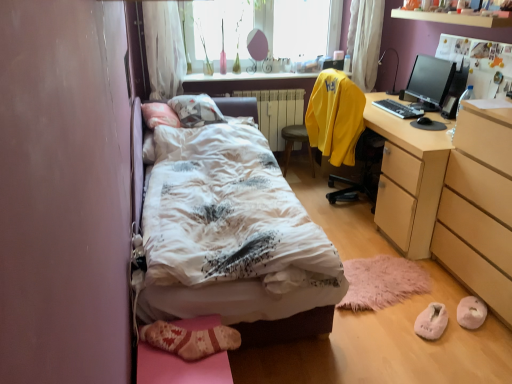
Question: From a real-world perspective, is white fluffy slippers at lower right, positioned as the 3th shoe in left-to-right order, above or below black plastic keyboard at right?

Choices:
 (A) below
 (B) above

Answer: (A)

Question: Considering the positions of point (472, 302) and point (396, 102), is point (472, 302) closer or farther from the camera than point (396, 102)?

Choices:
 (A) farther
 (B) closer

Answer: (B)

Question: Considering the real-world distances, which object is closest to the pink fluffy yoga mat at lower right?

Choices:
 (A) white metallic radiator at center
 (B) white sheer curtain at upper left, which is the first curtain from left to right
 (C) yellow fabric chair at center
 (D) knitted wool socks at lower left, which appears as the 3th shoe when viewed from the back
 (E) yellow matte sweatshirt at upper right

Answer: (E)

Question: Which object is the farthest from the black plastic keyboard at right?

Choices:
 (A) white sheer curtain at upper left, the 2th curtain in the right-to-left sequence
 (B) white fluffy slippers at lower right, acting as the first shoe starting from the right
 (C) light brown wood dresser at right
 (D) white sheer curtain at upper center, which ranks as the 1th curtain in right-to-left order
 (E) black glossy monitor at upper right

Answer: (A)